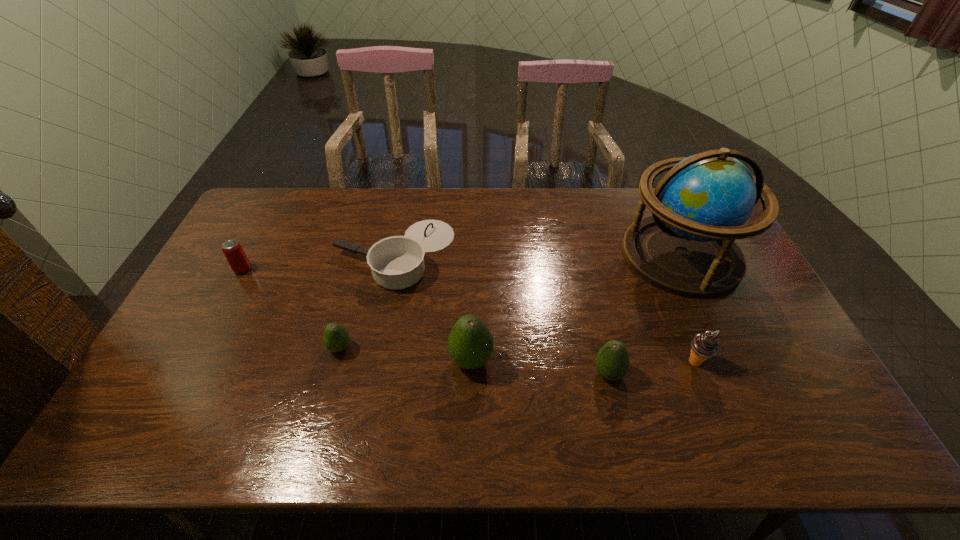
You are a GUI agent. You are given a task and a screenshot of the screen. Output one action in this format:
    pyautogui.click(x=<x>, y=<y>)
    Task: Click on the vacant space that is in between the globe and the beer can
    This screenshot has height=540, width=960.
    Given the screenshot: What is the action you would take?
    pyautogui.click(x=462, y=262)

You are a GUI agent. You are given a task and a screenshot of the screen. Output one action in this format:
    pyautogui.click(x=<x>, y=<y>)
    Task: Click on the free space between the shortest object and the leftmost avocado
    This screenshot has width=960, height=540.
    Given the screenshot: What is the action you would take?
    pyautogui.click(x=368, y=301)

Find the location of a particular element. The image size is (960, 540). free space that is in between the globe and the second tallest object is located at coordinates (576, 308).

Where is `free space between the leftmost avocado and the tallest object`? The image size is (960, 540). free space between the leftmost avocado and the tallest object is located at coordinates (511, 301).

This screenshot has height=540, width=960. Find the location of `unoccupied position between the second tallest avocado and the shortest object`. unoccupied position between the second tallest avocado and the shortest object is located at coordinates (501, 314).

Identify the location of empty location between the icecream and the tallest object. This screenshot has height=540, width=960. (688, 309).

This screenshot has width=960, height=540. In order to click on object that can be found as the fifth closest to the second avocado from right to left in this screenshot , I will do `click(704, 345)`.

Identify which object is the second nearest to the saucepan. Please provide its 2D coordinates. Your answer should be formatted as a tuple, i.e. [(x, y)], where the tuple contains the x and y coordinates of a point satisfying the conditions above.

[(470, 343)]

The image size is (960, 540). I want to click on avocado object that ranks as the closest to the shortest object, so click(336, 338).

Identify which avocado is located as the second nearest to the leftmost object. Please provide its 2D coordinates. Your answer should be formatted as a tuple, i.e. [(x, y)], where the tuple contains the x and y coordinates of a point satisfying the conditions above.

[(470, 343)]